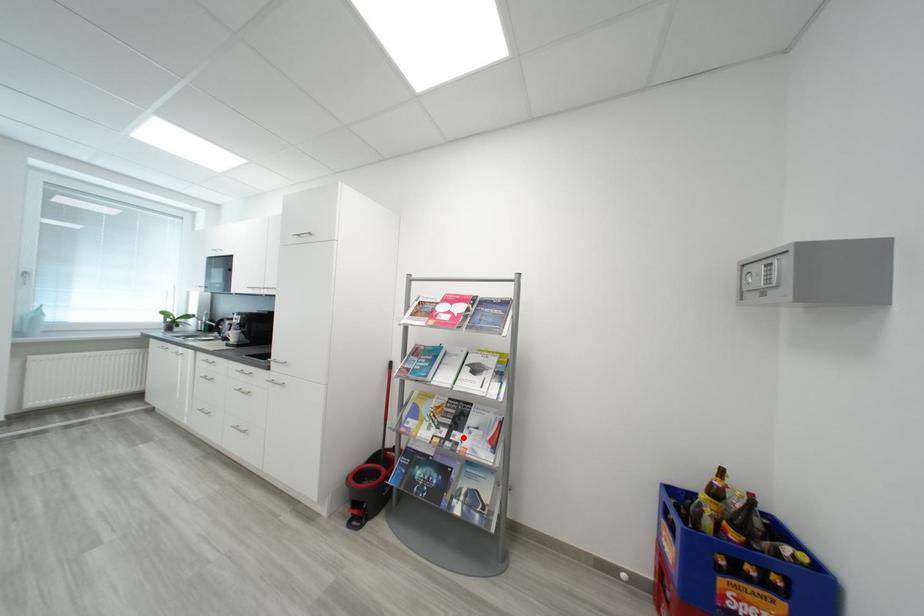
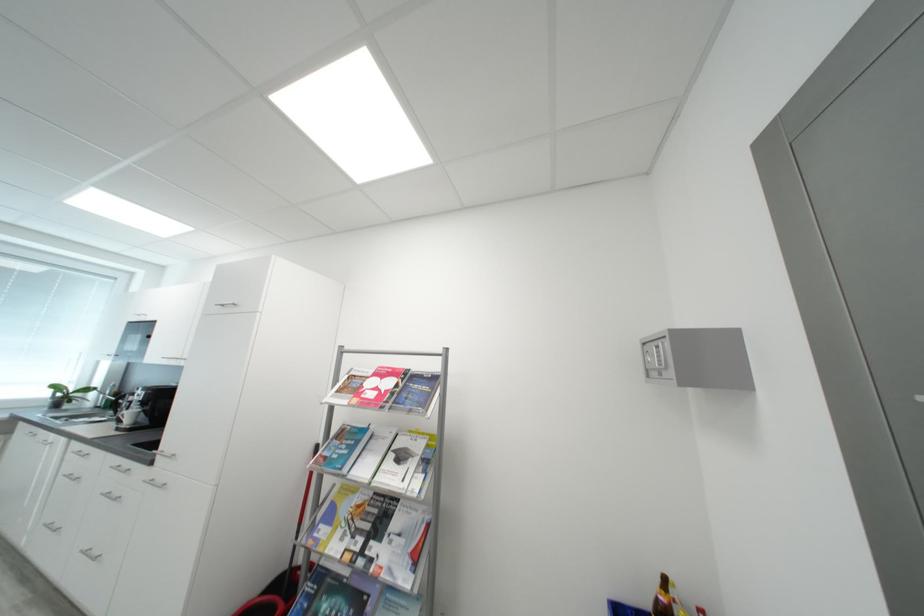
Question: I am providing you with two images of the same scene from different viewpoints. A red point is marked on the first image. At the location where the point appears in image 1, is it still visible in image 2?

Choices:
 (A) Yes
 (B) No

Answer: (A)